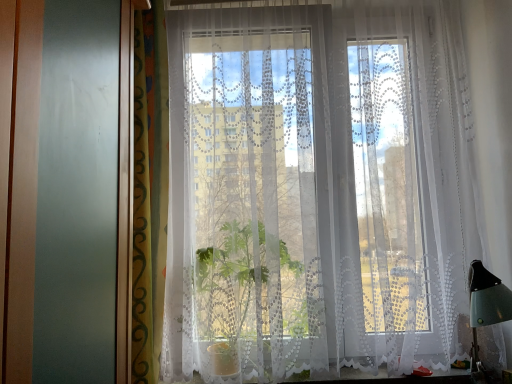
Identify the location of green patterned curtain at left, arranged as the second curtain when viewed from the right. (149, 190).

In order to click on green patterned curtain at left, arranged as the second curtain when viewed from the right in this screenshot , I will do `click(149, 190)`.

Is white lace curtain at center, placed as the 2th curtain when sorted from left to right, a part of green patterned curtain at left, arranged as the second curtain when viewed from the right?

No, white lace curtain at center, placed as the 2th curtain when sorted from left to right, is not a part of green patterned curtain at left, arranged as the second curtain when viewed from the right.

Is green patterned curtain at left, the first curtain positioned from the left, thinner than white lace curtain at center, positioned as the 1th curtain in right-to-left order?

Yes.

Considering the positions of objects green patterned curtain at left, the first curtain positioned from the left, and white lace curtain at center, positioned as the 1th curtain in right-to-left order, in the image provided, who is behind, green patterned curtain at left, the first curtain positioned from the left, or white lace curtain at center, positioned as the 1th curtain in right-to-left order,?

white lace curtain at center, positioned as the 1th curtain in right-to-left order, is further away from the camera.

From the image's perspective, which one is positioned lower, green patterned curtain at left, arranged as the second curtain when viewed from the right, or white lace curtain at center, positioned as the 1th curtain in right-to-left order?

→ green patterned curtain at left, arranged as the second curtain when viewed from the right.

From a real-world perspective, which object stands above the other?

From a 3D spatial view, green patterned curtain at left, the first curtain positioned from the left, is above.

Can you confirm if green patterned curtain at left, arranged as the second curtain when viewed from the right, is bigger than white lace curtain at lower center?

Correct, green patterned curtain at left, arranged as the second curtain when viewed from the right, is larger in size than white lace curtain at lower center.

Considering the sizes of objects green patterned curtain at left, the first curtain positioned from the left, and white lace curtain at lower center in the image provided, who is shorter, green patterned curtain at left, the first curtain positioned from the left, or white lace curtain at lower center?

white lace curtain at lower center is shorter.

Considering the points (163, 253) and (466, 373), which point is in front, point (163, 253) or point (466, 373)?

The point (163, 253) is closer.

Is white lace curtain at center, positioned as the 1th curtain in right-to-left order, at the left side of green patterned curtain at left, the first curtain positioned from the left?

In fact, white lace curtain at center, positioned as the 1th curtain in right-to-left order, is to the right of green patterned curtain at left, the first curtain positioned from the left.

Is green patterned curtain at left, arranged as the second curtain when viewed from the right, surrounded by white lace curtain at center, placed as the 2th curtain when sorted from left to right?

Actually, green patterned curtain at left, arranged as the second curtain when viewed from the right, is outside white lace curtain at center, placed as the 2th curtain when sorted from left to right.

In the scene shown: How different are the orientations of white lace curtain at center, positioned as the 1th curtain in right-to-left order, and green patterned curtain at left, arranged as the second curtain when viewed from the right, in degrees?

There is a 14.1-degree angle between the facing directions of white lace curtain at center, positioned as the 1th curtain in right-to-left order, and green patterned curtain at left, arranged as the second curtain when viewed from the right.

Does white lace curtain at center, placed as the 2th curtain when sorted from left to right, come behind green patterned curtain at left, the first curtain positioned from the left?

That is True.

Does point (161, 382) lie behind point (151, 365)?

That is True.

Image resolution: width=512 pixels, height=384 pixels. What are the coordinates of `window sill behind the green patterned curtain at left, the first curtain positioned from the left` in the screenshot? It's located at (388, 378).

Could green patterned curtain at left, arranged as the second curtain when viewed from the right, be considered to be inside white lace curtain at lower center?

No, green patterned curtain at left, arranged as the second curtain when viewed from the right, is not surrounded by white lace curtain at lower center.

How much distance is there between white lace curtain at lower center and green patterned curtain at left, the first curtain positioned from the left?

white lace curtain at lower center is 27.20 inches from green patterned curtain at left, the first curtain positioned from the left.

Considering the points (399, 142) and (290, 383), which point is behind, point (399, 142) or point (290, 383)?

Point (399, 142)

Consider the image. Does white lace curtain at center, positioned as the 1th curtain in right-to-left order, turn towards white lace curtain at lower center?

No, white lace curtain at center, positioned as the 1th curtain in right-to-left order, is not aimed at white lace curtain at lower center.

Is white lace curtain at center, placed as the 2th curtain when sorted from left to right, next to white lace curtain at lower center?

No, white lace curtain at center, placed as the 2th curtain when sorted from left to right, is not next to white lace curtain at lower center.

From the image's perspective, relative to white lace curtain at lower center, is white lace curtain at center, placed as the 2th curtain when sorted from left to right, above or below?

white lace curtain at center, placed as the 2th curtain when sorted from left to right, is situated higher than white lace curtain at lower center in the image.

Based on the photo, does white lace curtain at lower center have a lesser width compared to white lace curtain at center, positioned as the 1th curtain in right-to-left order?

Indeed, white lace curtain at lower center has a lesser width compared to white lace curtain at center, positioned as the 1th curtain in right-to-left order.

Where is `window sill to the left of white lace curtain at center, placed as the 2th curtain when sorted from left to right`? Image resolution: width=512 pixels, height=384 pixels. window sill to the left of white lace curtain at center, placed as the 2th curtain when sorted from left to right is located at coordinates (388, 378).

Is white lace curtain at lower center next to white lace curtain at center, positioned as the 1th curtain in right-to-left order, and touching it?

No, white lace curtain at lower center is not with white lace curtain at center, positioned as the 1th curtain in right-to-left order.

Which object is closer to the camera taking this photo, white lace curtain at lower center or white lace curtain at center, placed as the 2th curtain when sorted from left to right?

white lace curtain at center, placed as the 2th curtain when sorted from left to right, is more forward.

Identify the location of curtain on the right side of green patterned curtain at left, arranged as the second curtain when viewed from the right. This screenshot has height=384, width=512. (317, 192).

What are the coordinates of `curtain lying on the left of white lace curtain at lower center` in the screenshot? It's located at (149, 190).

When comparing their distances from white lace curtain at lower center, does green patterned curtain at left, the first curtain positioned from the left, or white lace curtain at center, positioned as the 1th curtain in right-to-left order, seem closer?

Among the two, white lace curtain at center, positioned as the 1th curtain in right-to-left order, is located nearer to white lace curtain at lower center.

Considering their positions, is white lace curtain at center, placed as the 2th curtain when sorted from left to right, positioned closer to green patterned curtain at left, the first curtain positioned from the left, than white lace curtain at lower center?

Based on the image, white lace curtain at center, placed as the 2th curtain when sorted from left to right, appears to be nearer to green patterned curtain at left, the first curtain positioned from the left.

When comparing their distances from white lace curtain at center, placed as the 2th curtain when sorted from left to right, does green patterned curtain at left, the first curtain positioned from the left, or white lace curtain at lower center seem further?

The object further to white lace curtain at center, placed as the 2th curtain when sorted from left to right, is white lace curtain at lower center.

Which object lies further to the anchor point white lace curtain at center, positioned as the 1th curtain in right-to-left order, white lace curtain at lower center or green patterned curtain at left, arranged as the second curtain when viewed from the right?

white lace curtain at lower center is further to white lace curtain at center, positioned as the 1th curtain in right-to-left order.

When comparing their distances from green patterned curtain at left, arranged as the second curtain when viewed from the right, does white lace curtain at lower center or white lace curtain at center, placed as the 2th curtain when sorted from left to right, seem further?

white lace curtain at lower center is further to green patterned curtain at left, arranged as the second curtain when viewed from the right.

Estimate the real-world distances between objects in this image. Which object is further from white lace curtain at lower center, white lace curtain at center, positioned as the 1th curtain in right-to-left order, or green patterned curtain at left, the first curtain positioned from the left?

green patterned curtain at left, the first curtain positioned from the left, is further to white lace curtain at lower center.

Locate an element on the screen. curtain between white lace curtain at center, positioned as the 1th curtain in right-to-left order, and white lace curtain at lower center, in the vertical direction is located at coordinates (149, 190).